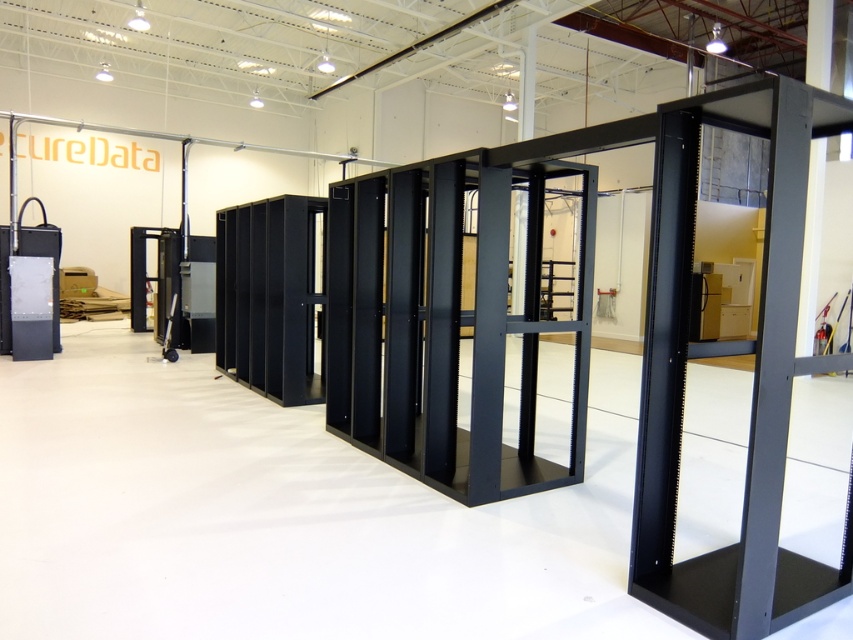
Question: Which of the following is the closest to the observer?

Choices:
 (A) (21, 280)
 (B) (666, 228)
 (C) (172, 314)

Answer: (B)

Question: Does matte black server at left appear over metallic gray server rack at center?

Choices:
 (A) no
 (B) yes

Answer: (B)

Question: Is matte black server at left to the left of metallic gray server rack at center from the viewer's perspective?

Choices:
 (A) no
 (B) yes

Answer: (B)

Question: Which of the following is the closest to the observer?

Choices:
 (A) (173, 305)
 (B) (793, 182)

Answer: (B)

Question: Which object appears farthest from the camera in this image?

Choices:
 (A) matte black server at left
 (B) black metal server rack at center
 (C) metallic gray server rack at center

Answer: (C)

Question: Does black metal server rack at center appear over metallic gray server rack at center?

Choices:
 (A) no
 (B) yes

Answer: (B)